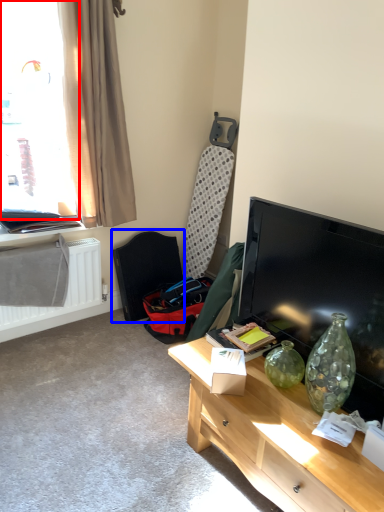
Question: Which object appears closest to the camera in this image, window (highlighted by a red box) or swivel chair (highlighted by a blue box)?

Choices:
 (A) window
 (B) swivel chair

Answer: (A)